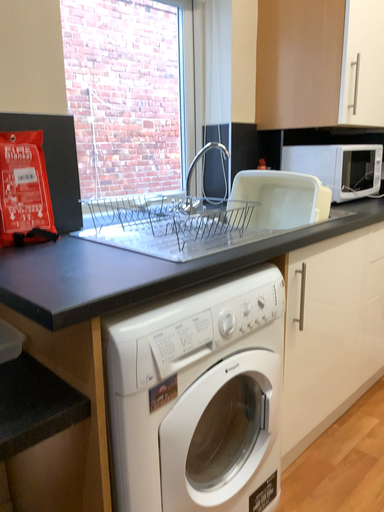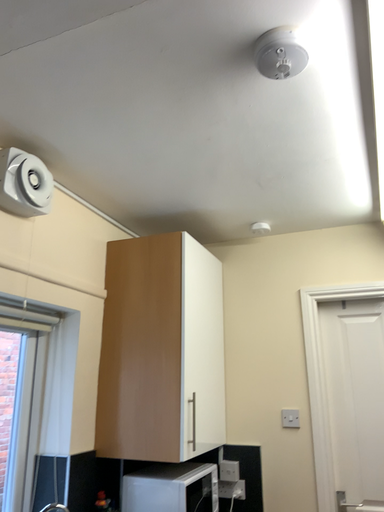
Question: How did the camera likely rotate when shooting the video?

Choices:
 (A) rotated upward
 (B) rotated downward

Answer: (A)